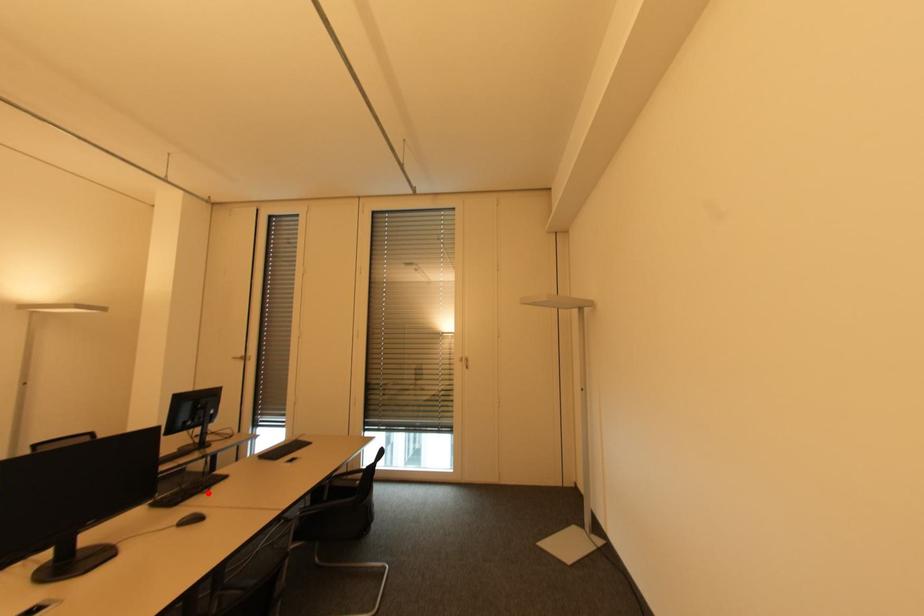
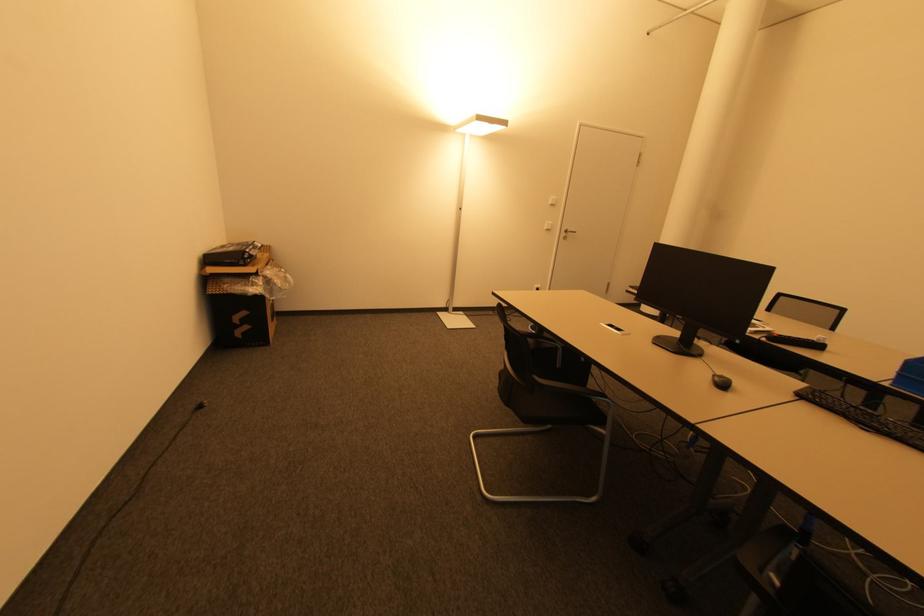
Locate, in the second image, the point that corresponds to the highlighted location in the first image.

(868, 430)